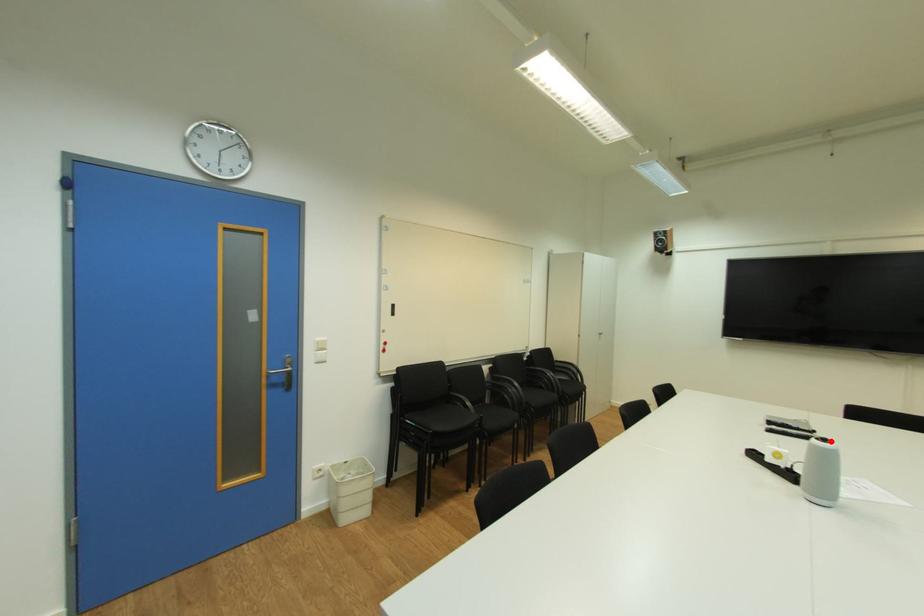
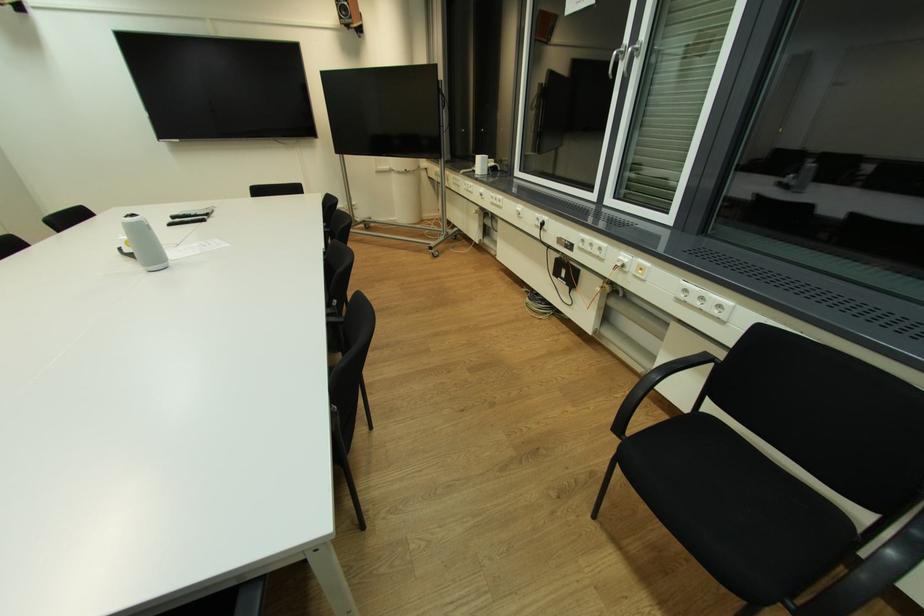
The point at the highlighted location is marked in the first image. Where is the corresponding point in the second image?

(137, 216)